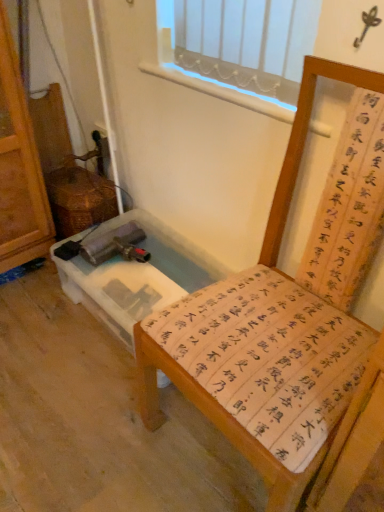
Question: Can you confirm if clear plastic vanity at lower left is positioned to the left of wooden chair with calligraphy cushion at center?

Choices:
 (A) yes
 (B) no

Answer: (A)

Question: From a real-world perspective, is clear plastic vanity at lower left over wooden chair with calligraphy cushion at center?

Choices:
 (A) yes
 (B) no

Answer: (B)

Question: Does clear plastic vanity at lower left appear on the right side of wooden chair with calligraphy cushion at center?

Choices:
 (A) yes
 (B) no

Answer: (B)

Question: Does clear plastic vanity at lower left have a larger size compared to wooden chair with calligraphy cushion at center?

Choices:
 (A) yes
 (B) no

Answer: (B)

Question: Is clear plastic vanity at lower left closer to the viewer compared to wooden chair with calligraphy cushion at center?

Choices:
 (A) no
 (B) yes

Answer: (A)

Question: Is clear plastic vanity at lower left oriented towards wooden chair with calligraphy cushion at center?

Choices:
 (A) no
 (B) yes

Answer: (A)

Question: Does wooden chair with calligraphy cushion at center have a greater height compared to clear plastic vanity at lower left?

Choices:
 (A) yes
 (B) no

Answer: (A)

Question: From the image's perspective, would you say wooden chair with calligraphy cushion at center is positioned over clear plastic vanity at lower left?

Choices:
 (A) yes
 (B) no

Answer: (B)

Question: Could clear plastic vanity at lower left be considered to be inside wooden chair with calligraphy cushion at center?

Choices:
 (A) no
 (B) yes

Answer: (A)

Question: Considering the relative sizes of wooden chair with calligraphy cushion at center and clear plastic vanity at lower left in the image provided, is wooden chair with calligraphy cushion at center bigger than clear plastic vanity at lower left?

Choices:
 (A) no
 (B) yes

Answer: (B)

Question: Is wooden chair with calligraphy cushion at center at the right side of clear plastic vanity at lower left?

Choices:
 (A) yes
 (B) no

Answer: (A)

Question: Can you confirm if wooden chair with calligraphy cushion at center is shorter than clear plastic vanity at lower left?

Choices:
 (A) no
 (B) yes

Answer: (A)

Question: Choose the correct answer: Is wooden chair with calligraphy cushion at center inside clear plastic vanity at lower left or outside it?

Choices:
 (A) outside
 (B) inside

Answer: (A)